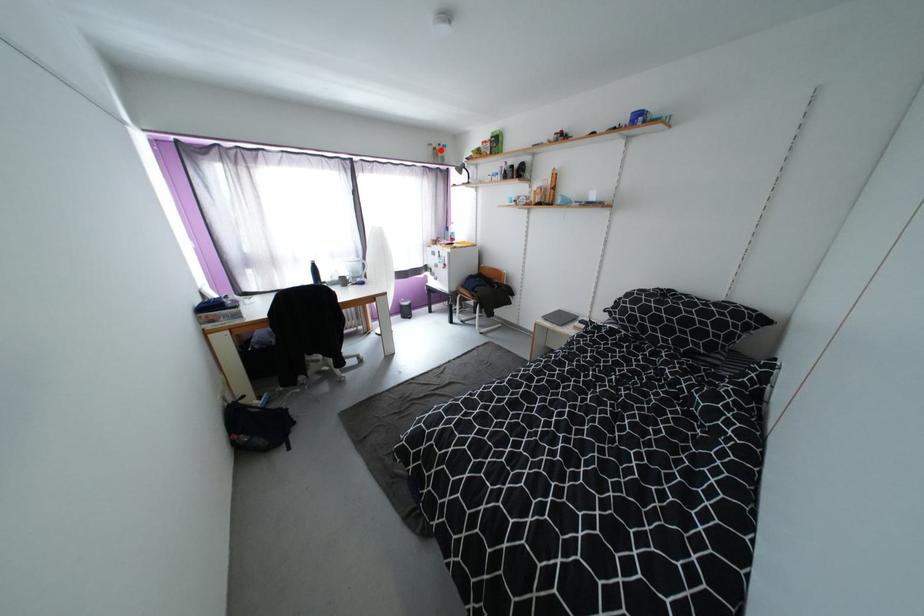
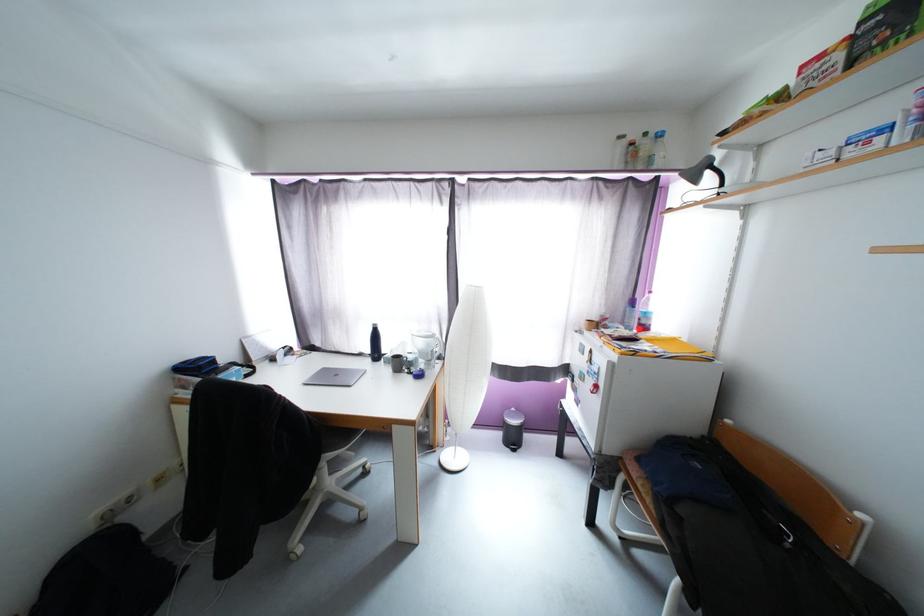
Find the pixel in the second image that matches the highlighted location in the first image.

(638, 146)